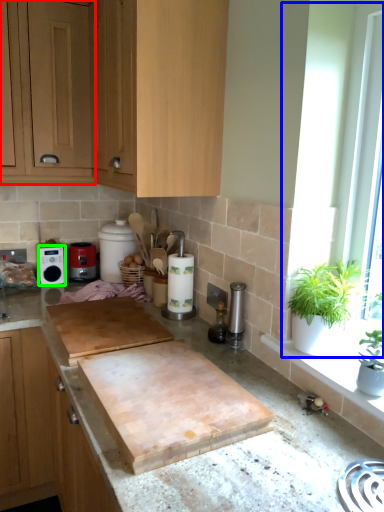
Question: Which object is positioned closest to cabinetry (highlighted by a red box)? Select from window frame (highlighted by a blue box) and appliance (highlighted by a green box).

Choices:
 (A) window frame
 (B) appliance

Answer: (B)